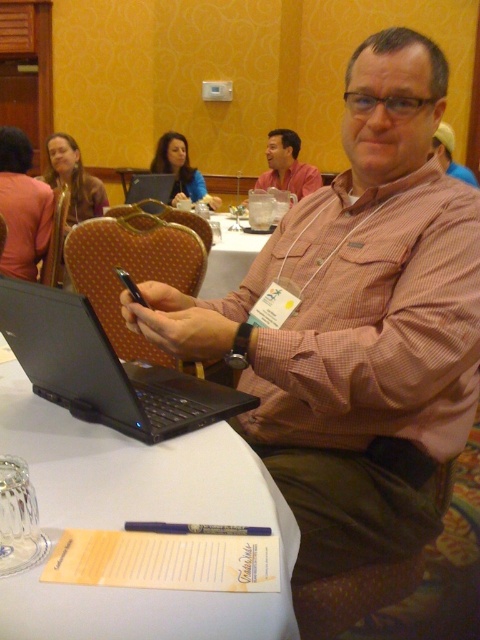
Question: Which object is closer to the camera taking this photo?

Choices:
 (A) yellow fabric headband at upper right
 (B) white paper at center
 (C) black matte laptop at center

Answer: (B)

Question: Which of the following is the farthest from the observer?

Choices:
 (A) pos(192,394)
 (B) pos(295,195)

Answer: (B)

Question: Is matte brown jacket at upper left to the right of matte blue shirt at upper center from the viewer's perspective?

Choices:
 (A) yes
 (B) no

Answer: (B)

Question: Can you confirm if white paper at center is positioned to the right of black matte laptop at center?

Choices:
 (A) yes
 (B) no

Answer: (A)

Question: Which point appears closest to the camera in this image?

Choices:
 (A) (442, 134)
 (B) (40, 452)

Answer: (B)

Question: From the image, what is the correct spatial relationship of black matte laptop at center in relation to matte blue shirt at upper center?

Choices:
 (A) right
 (B) left

Answer: (A)